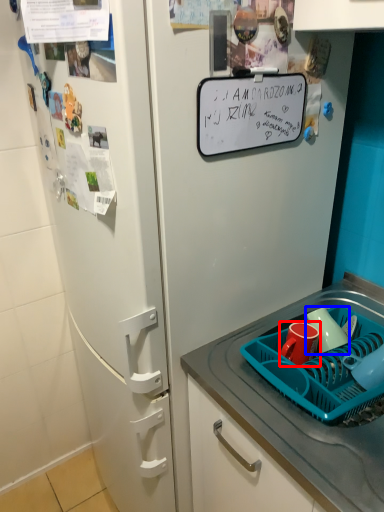
Question: Among these objects, which one is nearest to the camera, coffee cup (highlighted by a red box) or mug (highlighted by a blue box)?

Choices:
 (A) coffee cup
 (B) mug

Answer: (A)